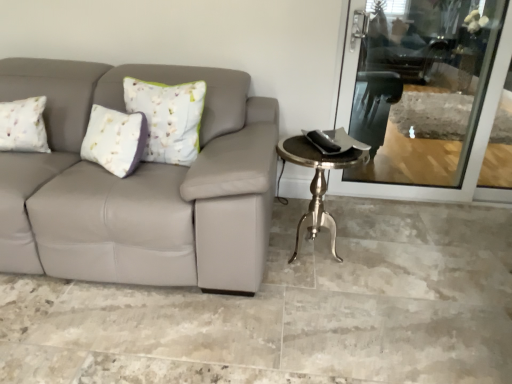
I want to click on free space behind silver metallic table at right, so click(x=298, y=216).